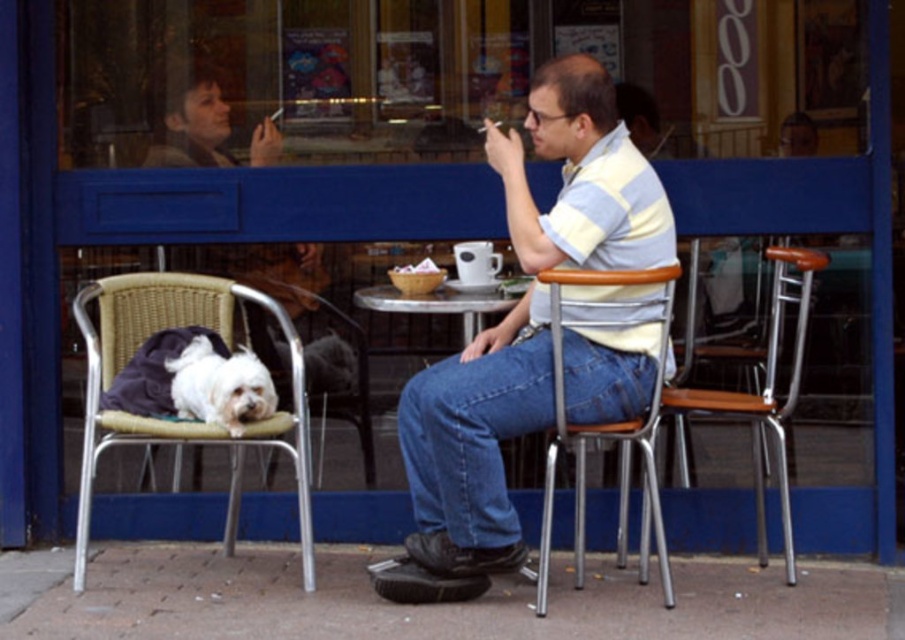
You are a delivery person who needs to place a package between the man and the woven wicker chair at left. The package requires 12 feet of space. Is there enough space between them?

The distance between the man and the woven wicker chair at left is 13.51 feet, which is more than the required 12 feet, so there is enough space to place the package between them.

You are a photographer trying to capture the striped cotton shirt at center and the white fur dog at left in a single shot. Based on their positions, which one would appear closer to the camera in the photo?

The striped cotton shirt at center appears closer to the camera because it is positioned under the white fur dog at left, meaning the dog is farther back in the frame.